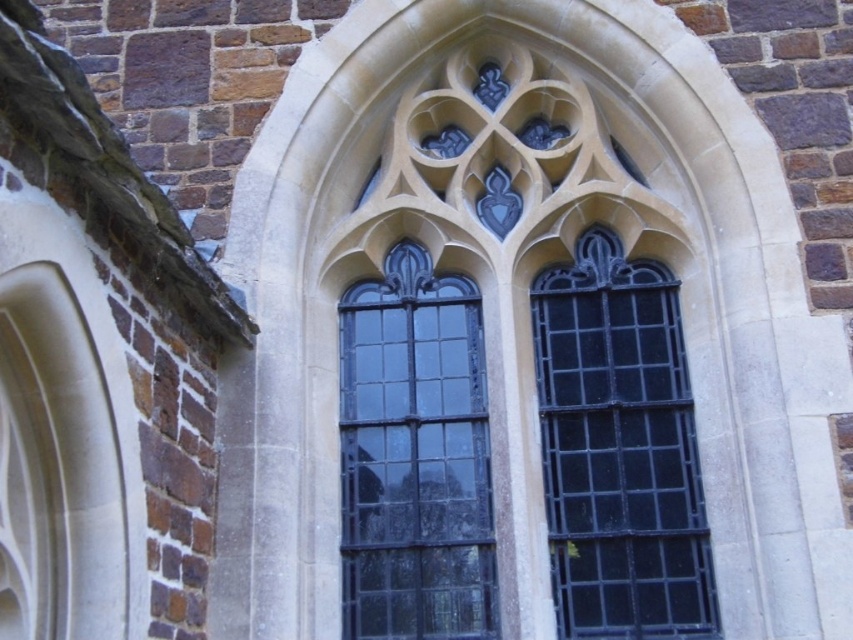
Question: Among these points, which one is farthest from the camera?

Choices:
 (A) (405, 292)
 (B) (642, 339)

Answer: (A)

Question: Which of the following is the farthest from the observer?

Choices:
 (A) (341, 472)
 (B) (643, 340)

Answer: (B)

Question: Can you confirm if black metal grid at center is thinner than black glass window at center?

Choices:
 (A) yes
 (B) no

Answer: (A)

Question: Is black metal grid at center smaller than black glass window at center?

Choices:
 (A) no
 (B) yes

Answer: (A)

Question: Can you confirm if black metal grid at center is bigger than black glass window at center?

Choices:
 (A) yes
 (B) no

Answer: (A)